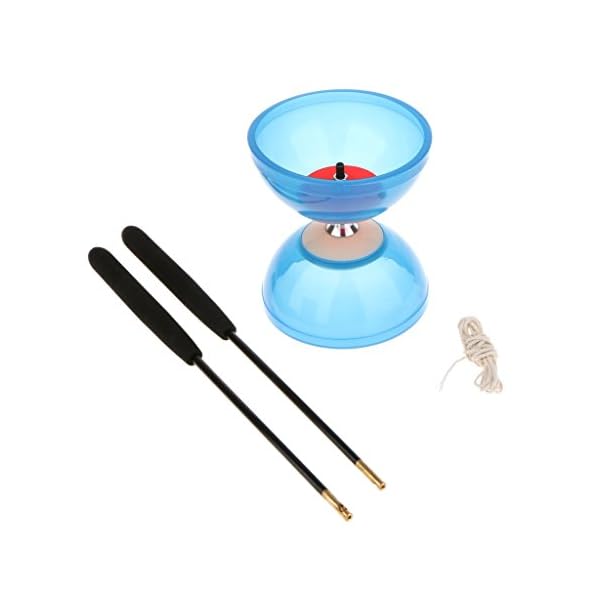
I want to click on rod, so click(x=312, y=404), click(x=289, y=448).